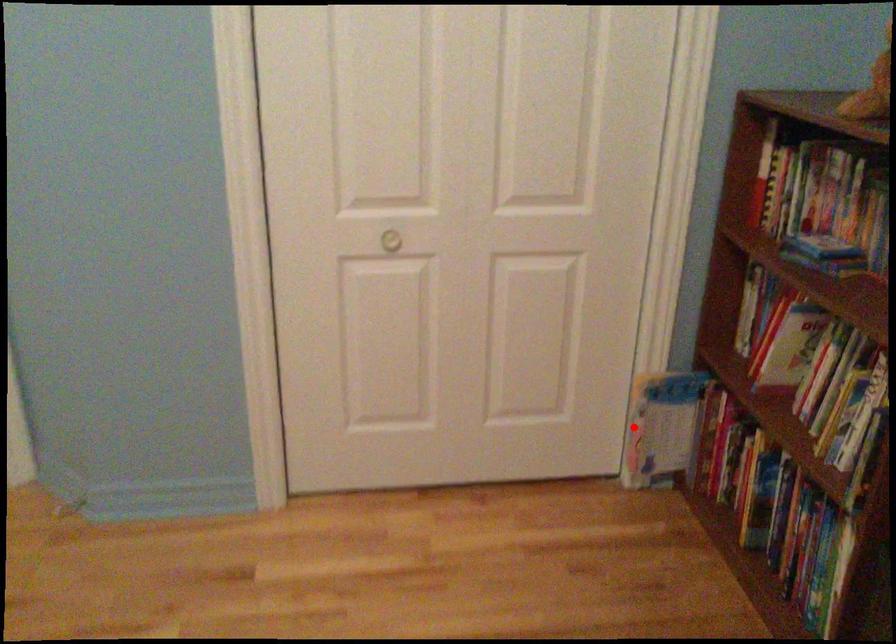
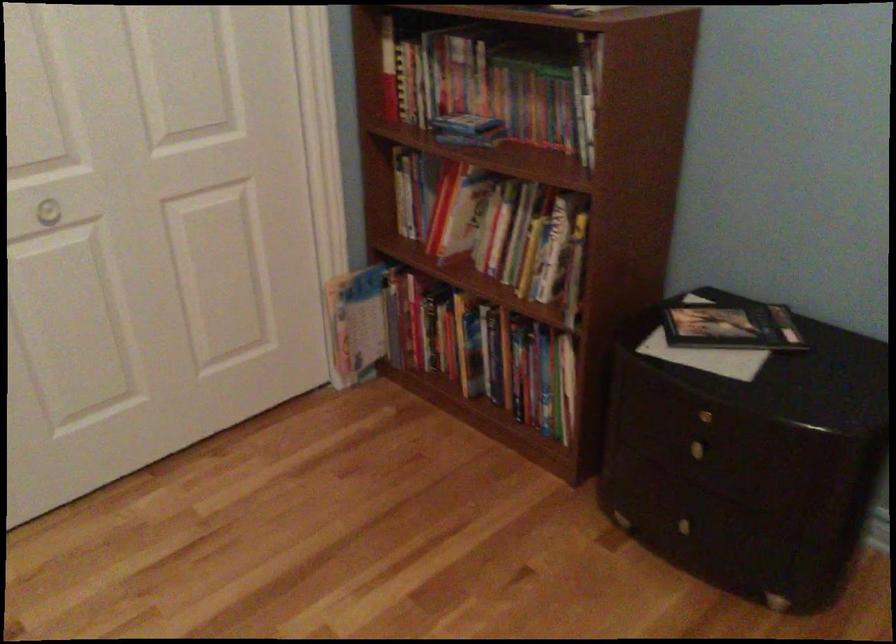
Find the pixel in the second image that matches the highlighted location in the first image.

(338, 332)